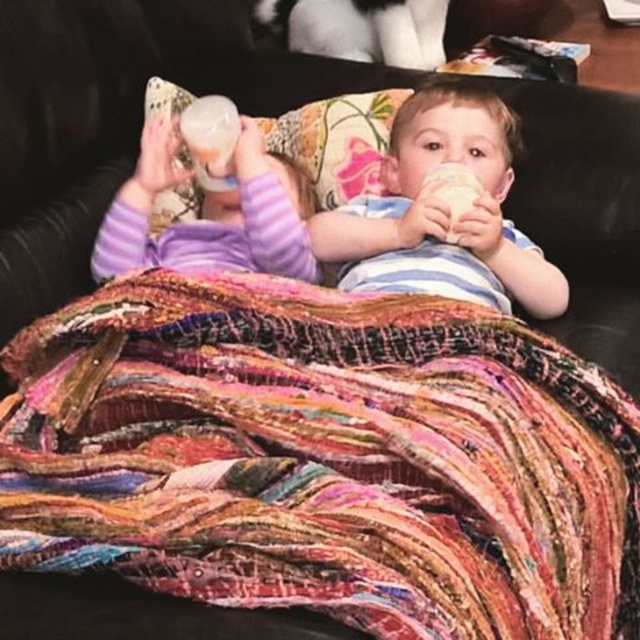
Question: Among these points, which one is farthest from the camera?

Choices:
 (A) (500, 156)
 (B) (317, 272)

Answer: (A)

Question: Which object appears closest to the camera in this image?

Choices:
 (A) black leather couch at center
 (B) multicolored woven fabric at center
 (C) striped cotton shirt at center
 (D) purple fleece onesie at left

Answer: (B)

Question: Based on their relative distances, which object is farther from the black leather couch at center?

Choices:
 (A) purple fleece onesie at left
 (B) striped cotton shirt at center

Answer: (A)

Question: Is multicolored woven fabric at center to the left of striped cotton shirt at center from the viewer's perspective?

Choices:
 (A) yes
 (B) no

Answer: (A)

Question: Can you confirm if multicolored woven fabric at center is thinner than black leather couch at center?

Choices:
 (A) yes
 (B) no

Answer: (A)

Question: Can you confirm if multicolored woven fabric at center is wider than purple fleece onesie at left?

Choices:
 (A) no
 (B) yes

Answer: (B)